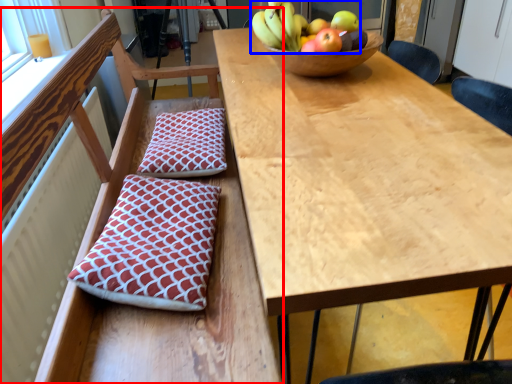
Question: Which object is closer to the camera taking this photo, chair (highlighted by a red box) or banana (highlighted by a blue box)?

Choices:
 (A) chair
 (B) banana

Answer: (A)